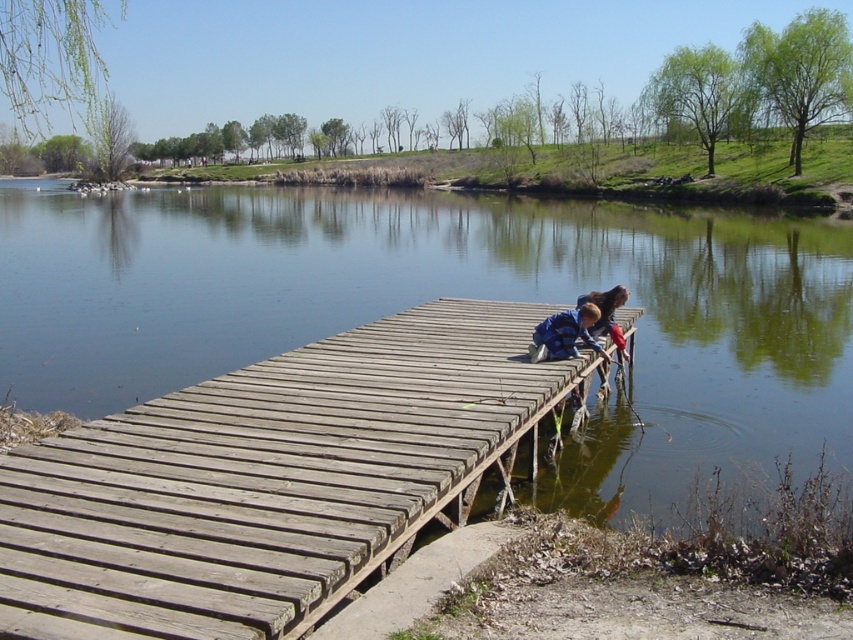
Between point (834, 336) and point (225, 625), which one is positioned behind?

Positioned behind is point (834, 336).

Is smooth water at center smaller than wooden dock at center?

Incorrect, smooth water at center is not smaller in size than wooden dock at center.

The width and height of the screenshot is (853, 640). I want to click on smooth water at center, so pyautogui.click(x=445, y=294).

This screenshot has height=640, width=853. What are the coordinates of `smooth water at center` in the screenshot? It's located at (x=445, y=294).

Is smooth water at center closer to camera compared to blue plaid shirt at center?

Yes, smooth water at center is in front of blue plaid shirt at center.

Which of these two, smooth water at center or blue plaid shirt at center, stands shorter?

Standing shorter between the two is blue plaid shirt at center.

Describe the element at coordinates (445, 294) in the screenshot. I see `smooth water at center` at that location.

I want to click on smooth water at center, so click(x=445, y=294).

Is wooden dock at center wider than blue plaid shirt at center?

Correct, the width of wooden dock at center exceeds that of blue plaid shirt at center.

Can you confirm if wooden dock at center is bigger than blue plaid shirt at center?

No, wooden dock at center is not bigger than blue plaid shirt at center.

Does point (277, 358) come farther from viewer compared to point (537, 330)?

No, (277, 358) is closer to viewer.

Find the location of `wooden dock at center`. wooden dock at center is located at coordinates (267, 480).